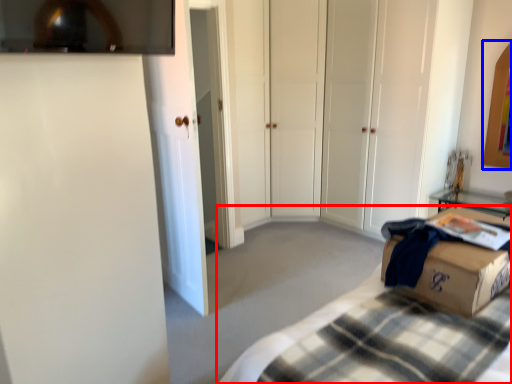
Question: Which object is closer to the camera taking this photo, bed (highlighted by a red box) or picture frame (highlighted by a blue box)?

Choices:
 (A) bed
 (B) picture frame

Answer: (A)